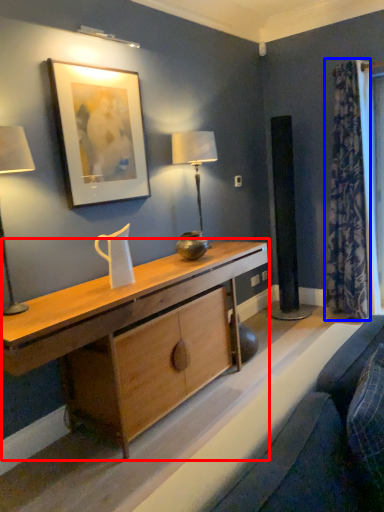
Question: Which of the following is the closest to the observer, desk (highlighted by a red box) or curtain (highlighted by a blue box)?

Choices:
 (A) desk
 (B) curtain

Answer: (A)